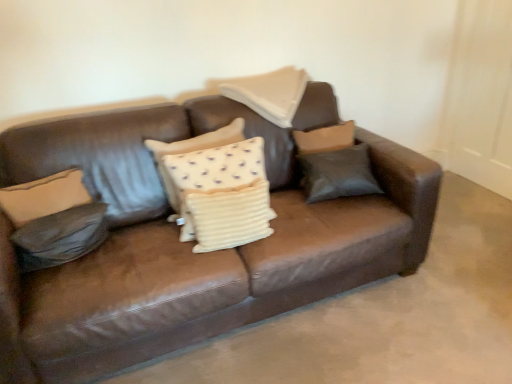
Question: From a real-world perspective, relative to beige fabric pillow at center, the 4th pillow viewed from the left, is leather pillow at left, which is counted as the first pillow, starting from the left, vertically above or below?

Choices:
 (A) above
 (B) below

Answer: (B)

Question: From the image's perspective, is leather pillow at left, which is counted as the first pillow, starting from the left, located above or below beige fabric pillow at center, the 4th pillow viewed from the left?

Choices:
 (A) above
 (B) below

Answer: (B)

Question: Which object is the closest to the leather pillow at left, which ranks as the 5th pillow in right-to-left order?

Choices:
 (A) brown leather couch at center
 (B) matte brown pillow at center, which ranks as the 1th pillow in right-to-left order
 (C) beige fabric pillow at center, the 4th pillow viewed from the left
 (D) white textured pillow at center, acting as the third pillow starting from the right
 (E) white textured pillow at center, the fourth pillow from the right

Answer: (A)

Question: Estimate the real-world distances between objects in this image. Which object is closer to the leather pillow at left, which ranks as the 5th pillow in right-to-left order?

Choices:
 (A) white textured pillow at center, positioned as the 2th pillow in left-to-right order
 (B) brown leather couch at center
 (C) white textured pillow at center, acting as the third pillow starting from the right
 (D) beige fabric pillow at center, the 4th pillow viewed from the left
 (E) matte brown pillow at center, the fifth pillow from the left

Answer: (B)